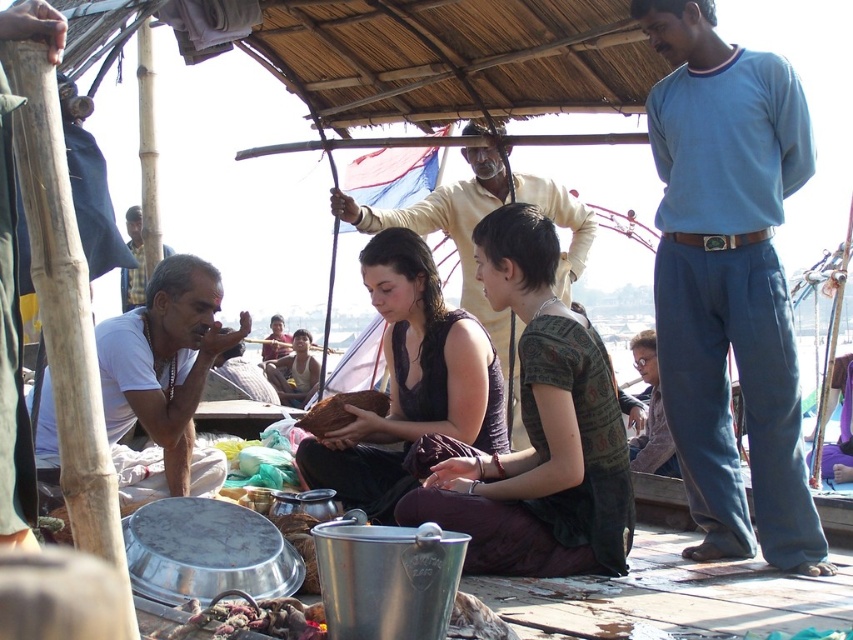
You are standing on the dock and want to hand a gift to both the blue cotton shirt at upper right and the white matte shirt at left. Which one should you give the gift to first if you want to follow the order from top to bottom?

You should give the gift to the blue cotton shirt at upper right first because it is positioned above the white matte shirt at left.

You are an observer standing in the middle of the scene. You see the blue cotton shirt at upper right and the white matte shirt at left. Which one appears taller?

The blue cotton shirt at upper right appears taller than the white matte shirt at left.

You are a photographer trying to capture a candid shot of the matte white shirt at left and the brown leather bag at center. Since you want to include both subjects in the frame, which object should you position closer to the edge of the photo to ensure both are visible?

The matte white shirt at left is positioned on the right side of brown leather bag at center, so to include both in the frame, position the brown leather bag at center closer to the edge of the photo.